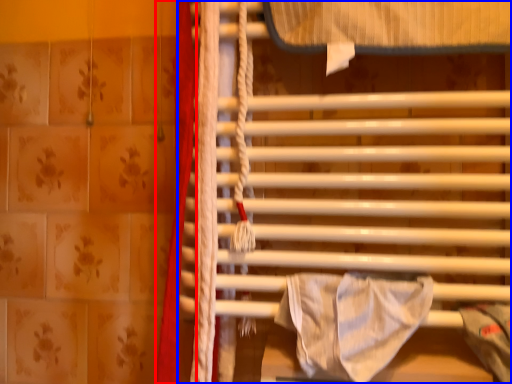
Question: Among these objects, which one is farthest to the camera, curtain (highlighted by a red box) or furniture (highlighted by a blue box)?

Choices:
 (A) curtain
 (B) furniture

Answer: (A)